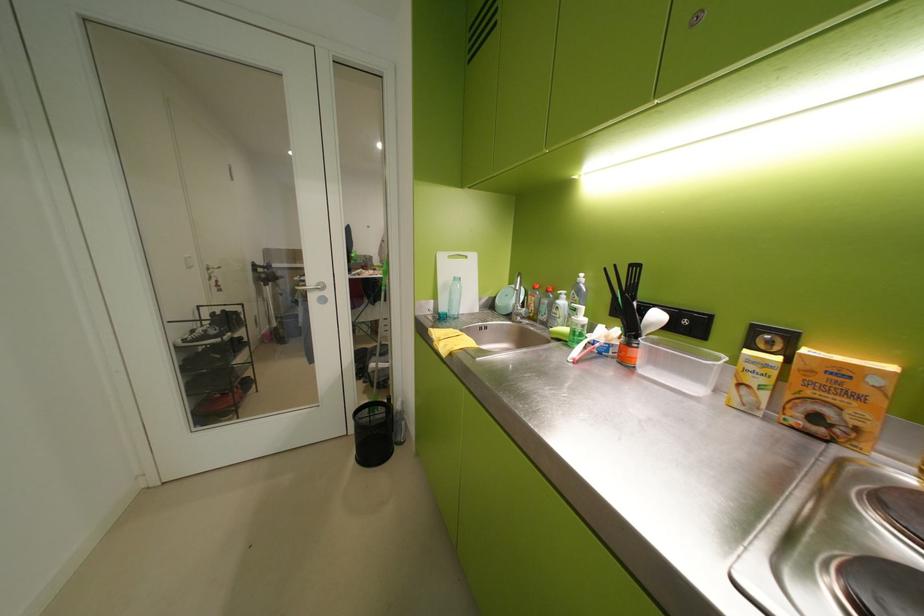
Where would you turn the white door handle? Please return your answer as a coordinate pair (x, y).

(309, 285)